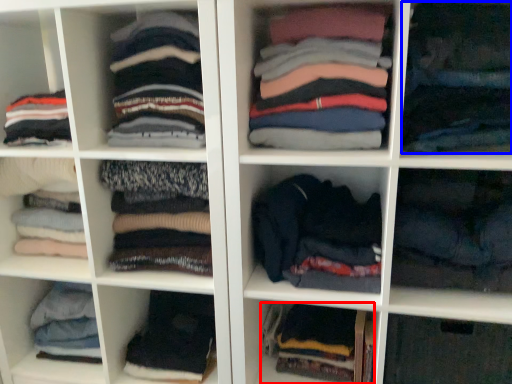
Question: Which object is further to the camera taking this photo, clothing (highlighted by a red box) or clothing (highlighted by a blue box)?

Choices:
 (A) clothing
 (B) clothing

Answer: (A)